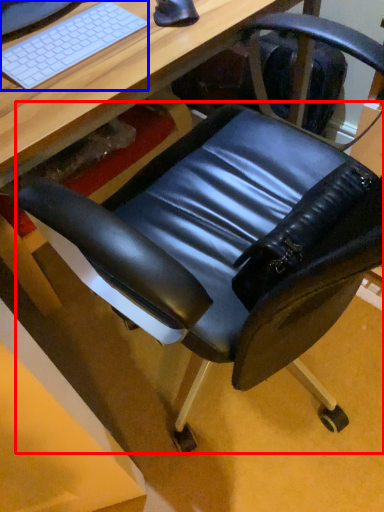
Question: Which object is further to the camera taking this photo, swivel chair (highlighted by a red box) or computer keyboard (highlighted by a blue box)?

Choices:
 (A) swivel chair
 (B) computer keyboard

Answer: (A)